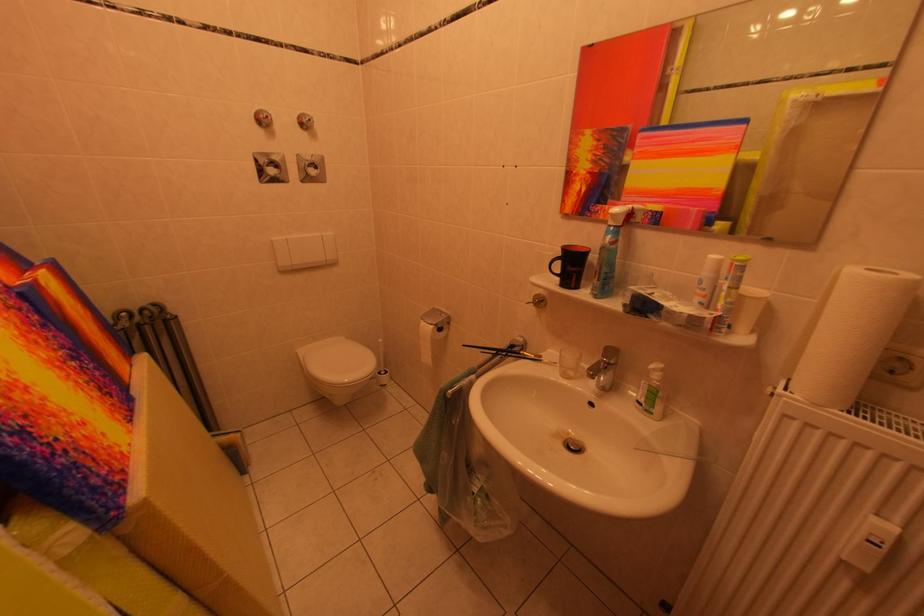
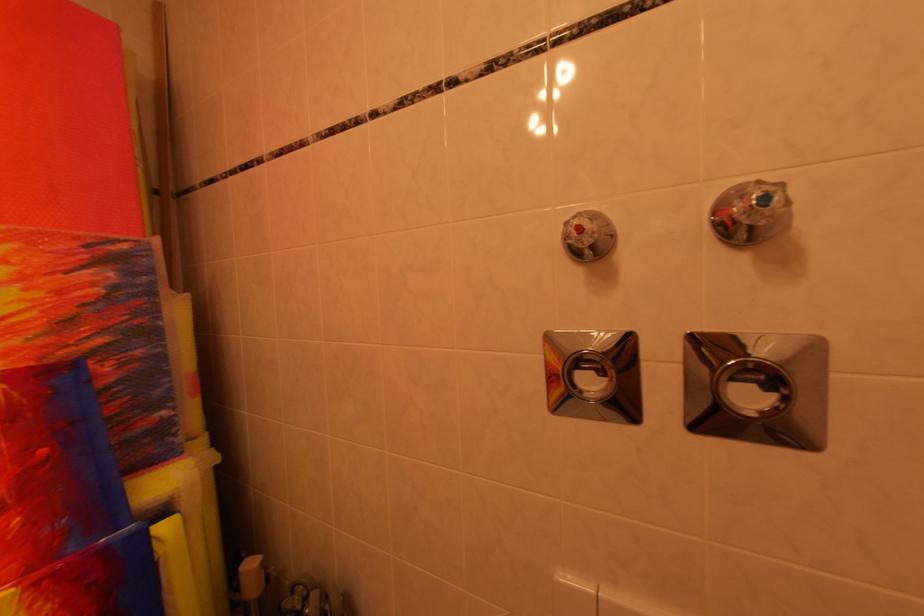
Find the pixel in the second image that matches the point at 285,172 in the first image.

(608, 379)